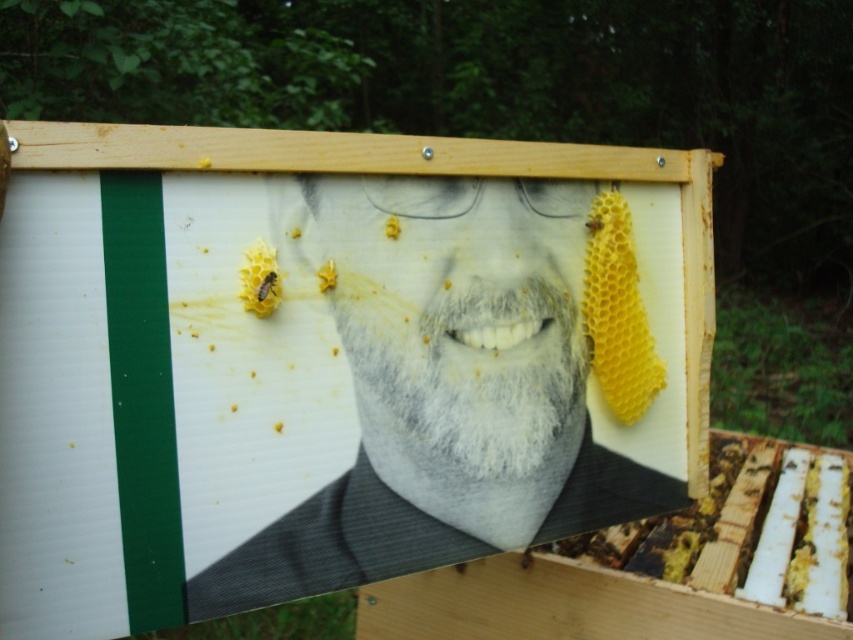
What are the coordinates of the translucent yellow honeycomb at center?

The translucent yellow honeycomb at center is located at coordinates point (326,275).